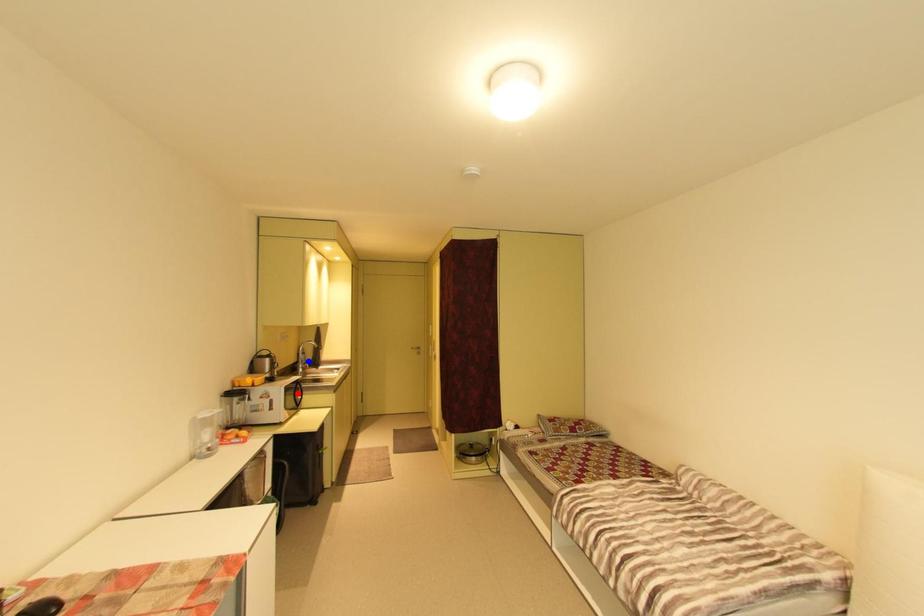
Order these from nearest to farthest:
orange point
blue point
red point

orange point → red point → blue point